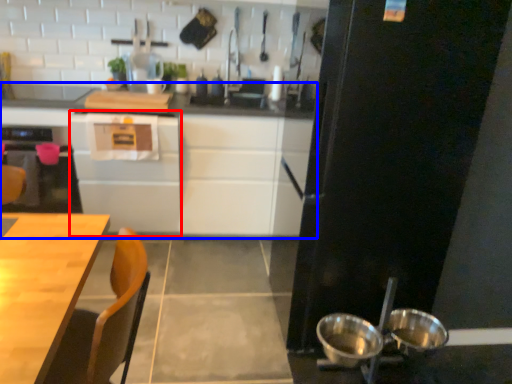
Question: Which of the following is the farthest to the observer, cabinetry (highlighted by a red box) or cabinetry (highlighted by a blue box)?

Choices:
 (A) cabinetry
 (B) cabinetry

Answer: (B)